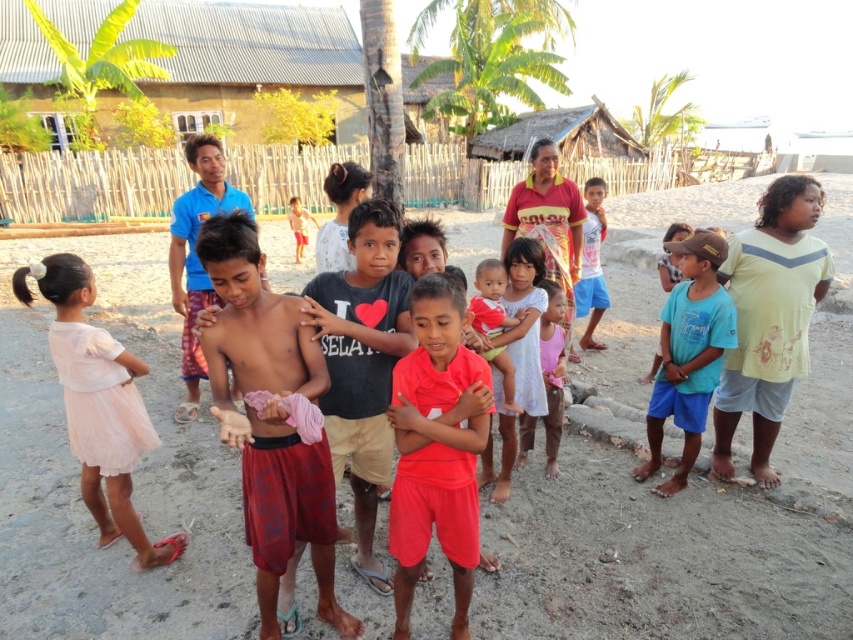
Question: Which of the following is the farthest from the observer?

Choices:
 (A) matte red shorts at right
 (B) pink fabric dress at center
 (C) red cotton shirt at center

Answer: (B)

Question: Is dark gray cotton shirt at center closer to camera compared to matte red shirt at center?

Choices:
 (A) yes
 (B) no

Answer: (A)

Question: Estimate the real-world distances between objects in this image. Which object is farther from the dark gray cotton shirt at center?

Choices:
 (A) pink fabric dress at center
 (B) pink tulle dress at lower left
 (C) red cotton shirt at center

Answer: (A)

Question: Can you confirm if matte red shorts at right is thinner than blue cotton shirt at center?

Choices:
 (A) no
 (B) yes

Answer: (A)

Question: Does reddish-brown fabric shorts at center appear over red cotton shirt at center?

Choices:
 (A) no
 (B) yes

Answer: (A)

Question: Among these objects, which one is farthest from the camera?

Choices:
 (A) matte red shirt at center
 (B) pink fabric dress at center
 (C) pink tulle dress at lower left
 (D) reddish-brown fabric shorts at center

Answer: (A)